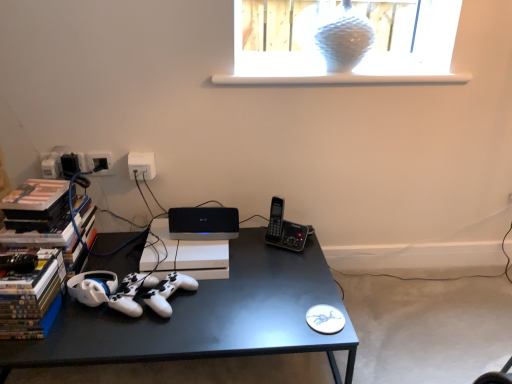
Question: Is black matte desk at center far away from white plastic electrical outlet at upper center?

Choices:
 (A) yes
 (B) no

Answer: (B)

Question: Is black matte desk at center further to camera compared to white plastic electrical outlet at upper center?

Choices:
 (A) no
 (B) yes

Answer: (A)

Question: Does black matte desk at center have a smaller size compared to white plastic electrical outlet at upper center?

Choices:
 (A) no
 (B) yes

Answer: (A)

Question: Does black matte desk at center turn towards white plastic electrical outlet at upper center?

Choices:
 (A) yes
 (B) no

Answer: (B)

Question: Would you say white plastic electrical outlet at upper center is part of black matte desk at center's contents?

Choices:
 (A) yes
 (B) no

Answer: (B)

Question: Does black matte desk at center have a lesser width compared to white plastic electrical outlet at upper center?

Choices:
 (A) yes
 (B) no

Answer: (B)

Question: Does white matte game controller at center come in front of white plastic electrical outlet at upper center?

Choices:
 (A) yes
 (B) no

Answer: (A)

Question: From a real-world perspective, is white matte game controller at center physically below white plastic electrical outlet at upper center?

Choices:
 (A) yes
 (B) no

Answer: (A)

Question: Can you confirm if white matte game controller at center is shorter than white plastic electrical outlet at upper center?

Choices:
 (A) yes
 (B) no

Answer: (A)

Question: Are white matte game controller at center and white plastic electrical outlet at upper center making contact?

Choices:
 (A) yes
 (B) no

Answer: (B)

Question: Is white matte game controller at center facing away from white plastic electrical outlet at upper center?

Choices:
 (A) yes
 (B) no

Answer: (B)

Question: Does white matte game controller at center have a lesser width compared to white plastic electrical outlet at upper center?

Choices:
 (A) yes
 (B) no

Answer: (B)

Question: Does hardcover books at left lie behind white matte game controller at center?

Choices:
 (A) no
 (B) yes

Answer: (A)